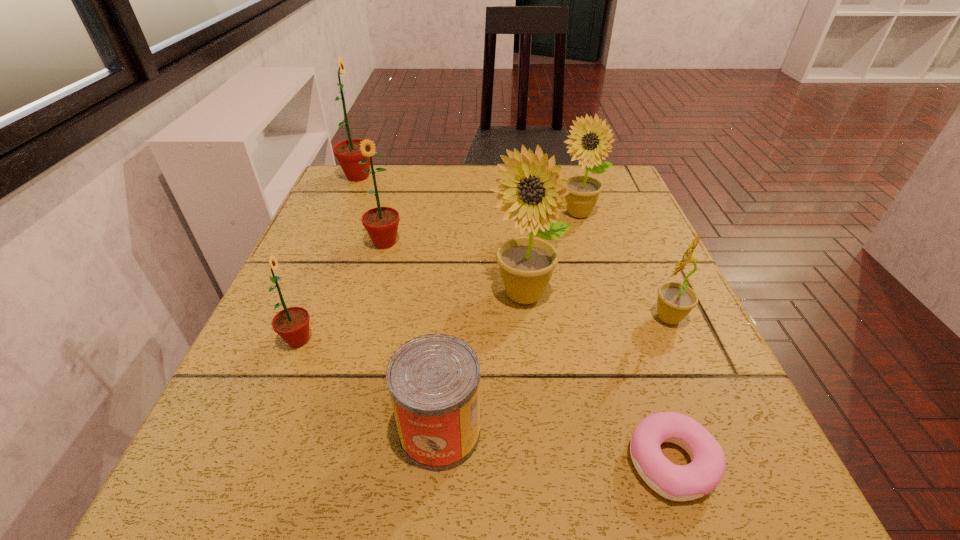
The image size is (960, 540). I want to click on vacant space located on the face of the smallest yellow sunflower, so (588, 318).

Locate an element on the screen. This screenshot has width=960, height=540. free spot located on the face of the smallest yellow sunflower is located at coordinates (598, 318).

Locate an element on the screen. The height and width of the screenshot is (540, 960). vacant region located on the face of the smallest green sunflower is located at coordinates (499, 340).

The image size is (960, 540). I want to click on vacant space located 0.070m on the back of the can, so click(x=445, y=360).

Identify the location of free region located 0.110m on the back of the pink pastry. (637, 361).

Where is `can present at the near edge`? This screenshot has height=540, width=960. can present at the near edge is located at coordinates (434, 380).

Locate an element on the screen. This screenshot has height=540, width=960. pastry present at the near edge is located at coordinates [674, 482].

Locate an element on the screen. The image size is (960, 540). pastry present at the right edge is located at coordinates (674, 482).

This screenshot has height=540, width=960. I want to click on object positioned at the far left corner, so click(347, 152).

Locate an element on the screen. The width and height of the screenshot is (960, 540). object that is at the far right corner is located at coordinates (588, 147).